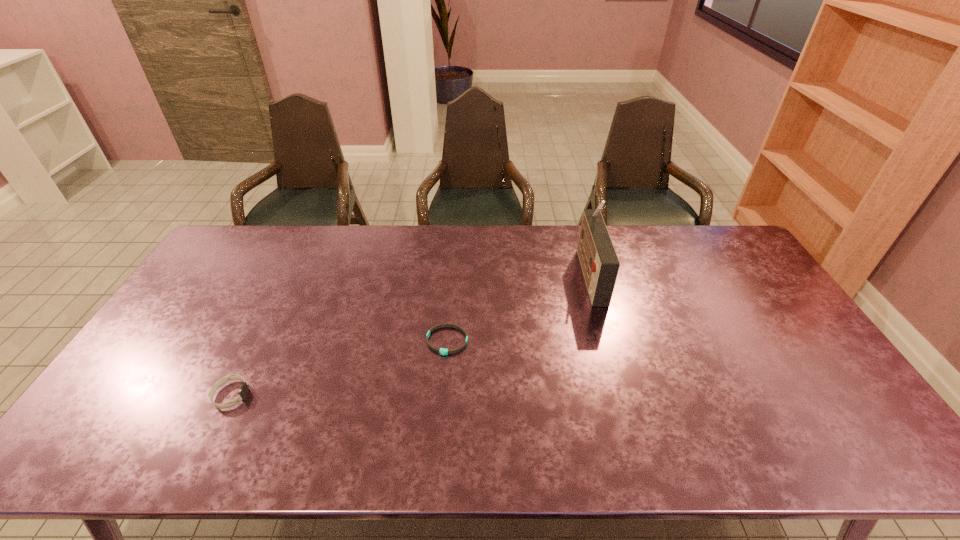
Where is `vacant area between the nearer wristband and the rightmost object`? The width and height of the screenshot is (960, 540). vacant area between the nearer wristband and the rightmost object is located at coordinates (410, 334).

This screenshot has height=540, width=960. Find the location of `vacant region between the tallest object and the farther wristband`. vacant region between the tallest object and the farther wristband is located at coordinates (518, 307).

Find the location of `free space that is in between the shortest object and the farthest object`. free space that is in between the shortest object and the farthest object is located at coordinates (518, 307).

At what (x,y) coordinates should I click in order to perform the action: click on blank region between the radio receiver and the shorter wristband. Please return your answer as a coordinate pair (x, y). The height and width of the screenshot is (540, 960). Looking at the image, I should click on (518, 307).

Where is `free space between the farther wristband and the taller wristband`? This screenshot has width=960, height=540. free space between the farther wristband and the taller wristband is located at coordinates (339, 368).

Identify the location of free space that is in between the leftmost object and the tallest object. The height and width of the screenshot is (540, 960). (410, 334).

Identify the location of vacant area that lies between the shortest object and the tallest object. (518, 307).

Identify the location of object that is the second closest to the nearest object. (599, 261).

Select which object appears as the closest to the second nearest object. Please provide its 2D coordinates. Your answer should be formatted as a tuple, i.e. [(x, y)], where the tuple contains the x and y coordinates of a point satisfying the conditions above.

[(599, 261)]

Identify the location of free spot that satisfies the following two spatial constraints: 1. on the buckle of the right wristband; 2. on the outer surface of the nearer wristband. (444, 395).